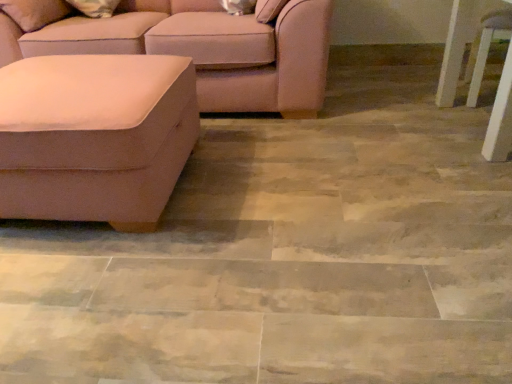
Question: Is suede-like beige couch at left, the 2th studio couch in the front-to-back sequence, aimed at white glossy side table at right?

Choices:
 (A) yes
 (B) no

Answer: (B)

Question: Is suede-like beige couch at left, which is counted as the first studio couch, starting from the back, thinner than white glossy side table at right?

Choices:
 (A) yes
 (B) no

Answer: (B)

Question: From the image's perspective, is suede-like beige couch at left, the 2th studio couch in the front-to-back sequence, located above white glossy side table at right?

Choices:
 (A) no
 (B) yes

Answer: (B)

Question: From a real-world perspective, does suede-like beige couch at left, which is counted as the first studio couch, starting from the back, stand above white glossy side table at right?

Choices:
 (A) no
 (B) yes

Answer: (B)

Question: Considering the relative sizes of suede-like beige couch at left, the 2th studio couch in the front-to-back sequence, and white glossy side table at right in the image provided, is suede-like beige couch at left, the 2th studio couch in the front-to-back sequence, shorter than white glossy side table at right?

Choices:
 (A) no
 (B) yes

Answer: (B)

Question: Can you confirm if suede-like beige couch at left, the 2th studio couch in the front-to-back sequence, is bigger than white glossy side table at right?

Choices:
 (A) no
 (B) yes

Answer: (B)

Question: Would you say white glossy side table at right contains suede-like beige ottoman at left, positioned as the 2th studio couch in back-to-front order?

Choices:
 (A) yes
 (B) no

Answer: (B)

Question: Can you confirm if white glossy side table at right is positioned to the left of suede-like beige ottoman at left, positioned as the 2th studio couch in back-to-front order?

Choices:
 (A) yes
 (B) no

Answer: (B)

Question: Is white glossy side table at right positioned in front of suede-like beige ottoman at left, positioned as the 2th studio couch in back-to-front order?

Choices:
 (A) no
 (B) yes

Answer: (A)

Question: Is white glossy side table at right behind suede-like beige ottoman at left, positioned as the 2th studio couch in back-to-front order?

Choices:
 (A) yes
 (B) no

Answer: (A)

Question: Is white glossy side table at right oriented away from suede-like beige ottoman at left, which ranks as the 1th studio couch in front-to-back order?

Choices:
 (A) no
 (B) yes

Answer: (A)

Question: From a real-world perspective, does white glossy side table at right stand above suede-like beige ottoman at left, positioned as the 2th studio couch in back-to-front order?

Choices:
 (A) yes
 (B) no

Answer: (A)

Question: Is suede-like beige ottoman at left, which ranks as the 1th studio couch in front-to-back order, oriented away from suede-like beige couch at left, the 2th studio couch in the front-to-back sequence?

Choices:
 (A) yes
 (B) no

Answer: (A)